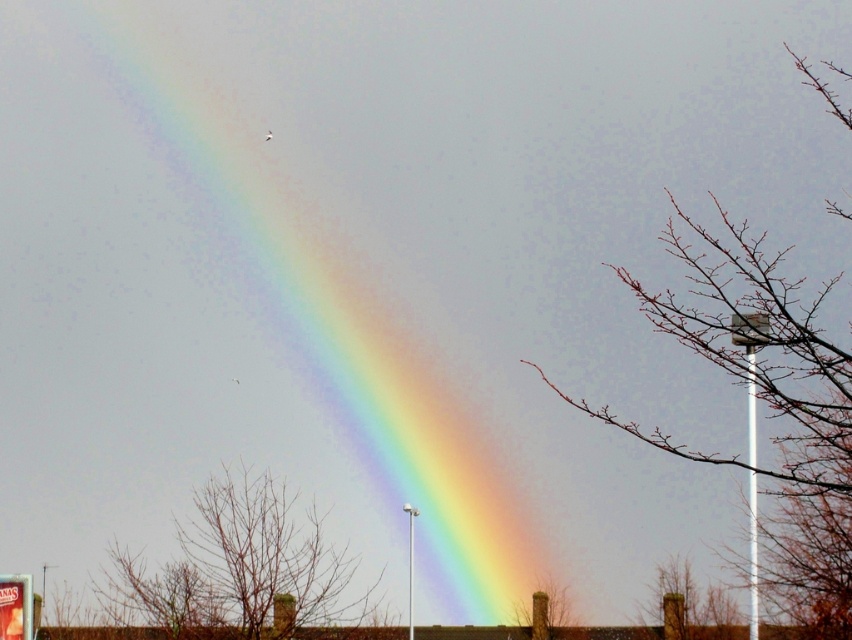
Which is below, rainbow at upper center or bare branches at right?

Positioned lower is rainbow at upper center.

Is point (272, 241) farther from camera compared to point (750, 582)?

Yes, point (272, 241) is farther from viewer.

Locate an element on the screen. rainbow at upper center is located at coordinates (297, 340).

Which is in front, point (266, 72) or point (573, 616)?

Positioned in front is point (266, 72).

Can you confirm if rainbow at upper center is positioned to the left of bare branches at lower center?

Yes, rainbow at upper center is to the left of bare branches at lower center.

What do you see at coordinates (297, 340) in the screenshot?
I see `rainbow at upper center` at bounding box center [297, 340].

Identify the location of rainbow at upper center. This screenshot has width=852, height=640. (297, 340).

Does bare branches at center appear on the left side of bare branches at lower center?

Yes, bare branches at center is to the left of bare branches at lower center.

In the scene shown: Does bare branches at center lie in front of bare branches at lower center?

That is True.

Which is behind, point (131, 556) or point (522, 612)?

Point (522, 612)

Where is `bare branches at center`? bare branches at center is located at coordinates (237, 564).